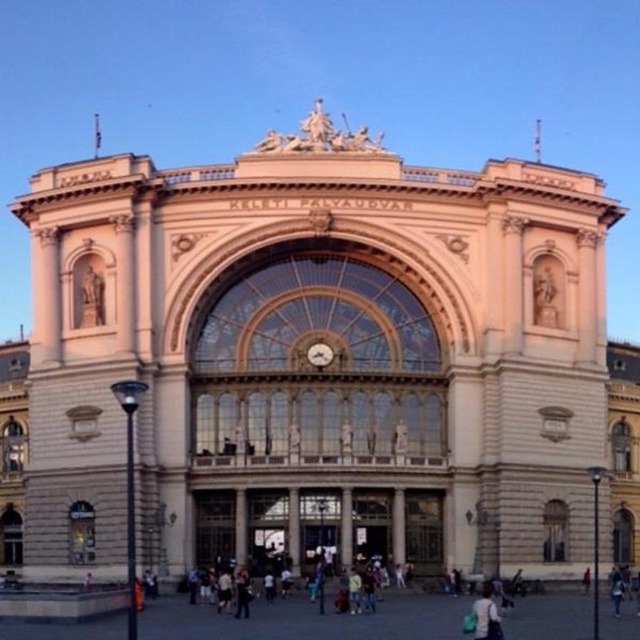
You are an architect analyzing the symmetry of Keleti Palyaudvar. You observe the beige stone pillar at center and the gold metallic clock at center. Which object is taller?

The beige stone pillar at center is much taller than the gold metallic clock at center.

You are standing in front of Keleti Palyaudvar and notice a light blue fabric bag at lower center and a gold metallic clock at center. Which object is positioned lower in the scene?

The light blue fabric bag at lower center is positioned lower than the gold metallic clock at center.